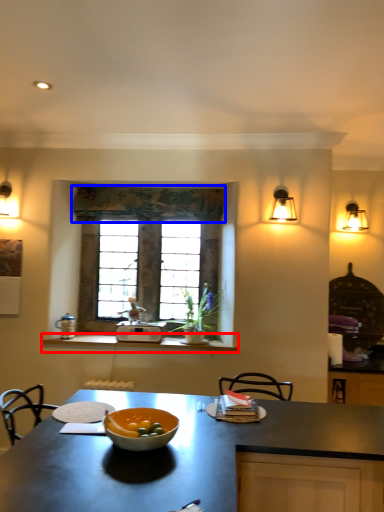
Question: Which point is closer to the camera, counter (highlighted by a red box) or curtain (highlighted by a blue box)?

Choices:
 (A) counter
 (B) curtain

Answer: (A)